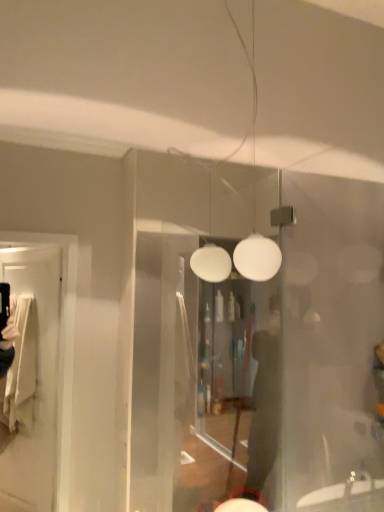
Find the location of a particular element. white matte globe at center is located at coordinates (255, 205).

Measure the distance between point (252, 49) and camera.

The distance of point (252, 49) from camera is 1.27 meters.

Measure the distance between white matte globe at center and camera.

white matte globe at center is 1.01 meters from camera.

Describe the element at coordinates (255, 205) in the screenshot. I see `white matte globe at center` at that location.

Based on the photo, what is the approximate width of white matte globe at center?

white matte globe at center is 4.16 inches in width.

The image size is (384, 512). I want to click on white matte globe at center, so click(x=255, y=205).